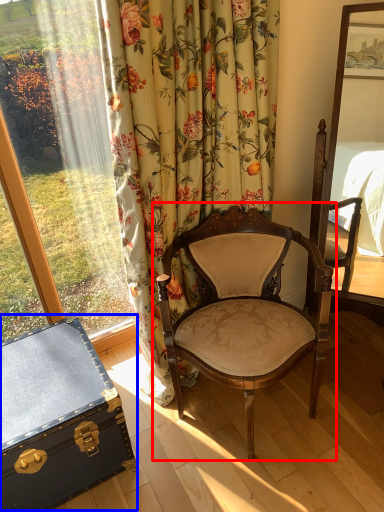
Question: Which point is further to the camera, chair (highlighted by a red box) or chest (highlighted by a blue box)?

Choices:
 (A) chair
 (B) chest

Answer: (B)